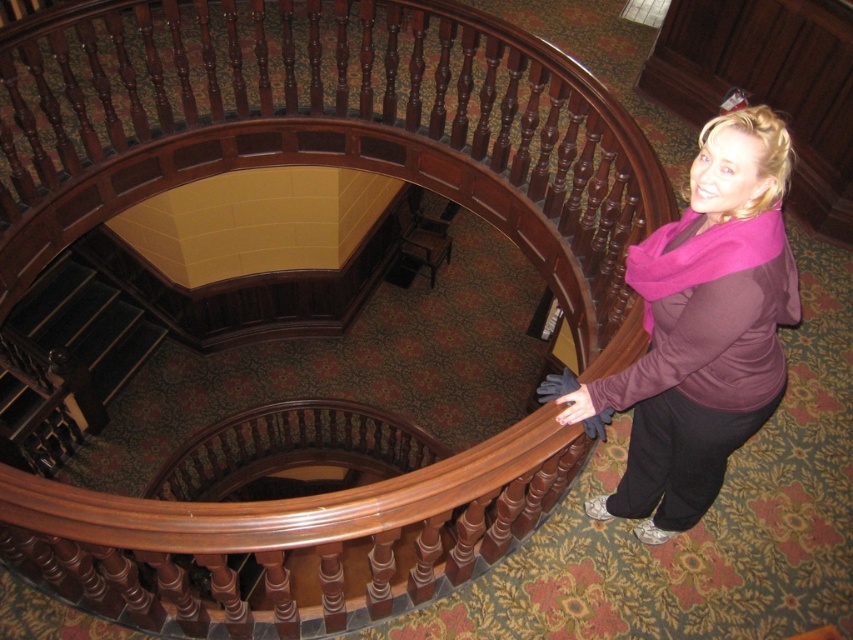
Question: Does matte pink scarf at lower right have a lesser width compared to dark wood stairs at lower left?

Choices:
 (A) yes
 (B) no

Answer: (A)

Question: Is matte pink scarf at lower right above dark wood stairs at lower left?

Choices:
 (A) yes
 (B) no

Answer: (A)

Question: Does matte pink scarf at lower right have a smaller size compared to dark wood stairs at lower left?

Choices:
 (A) no
 (B) yes

Answer: (B)

Question: Which point is farther to the camera?

Choices:
 (A) dark wood stairs at lower left
 (B) matte pink scarf at lower right

Answer: (A)